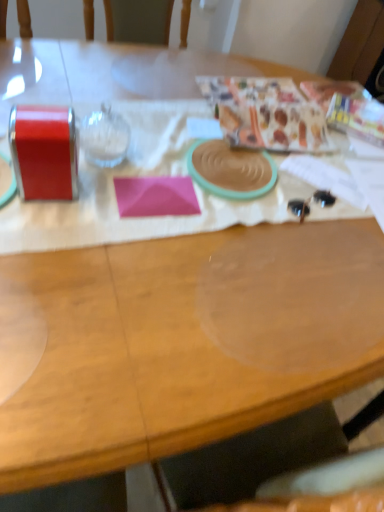
Where is `free space on the front side of patterned paper at upper right, which is counted as the 2th wrapping paper, starting from the left`? Image resolution: width=384 pixels, height=512 pixels. free space on the front side of patterned paper at upper right, which is counted as the 2th wrapping paper, starting from the left is located at coordinates (329, 187).